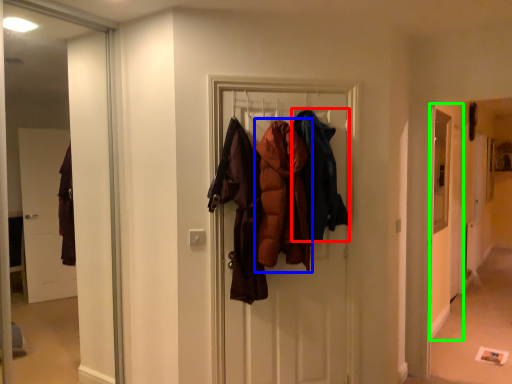
Question: Which object is positioned farthest from garment (highlighted by a red box)? Select from garment (highlighted by a blue box) and screen door (highlighted by a green box).

Choices:
 (A) garment
 (B) screen door

Answer: (B)